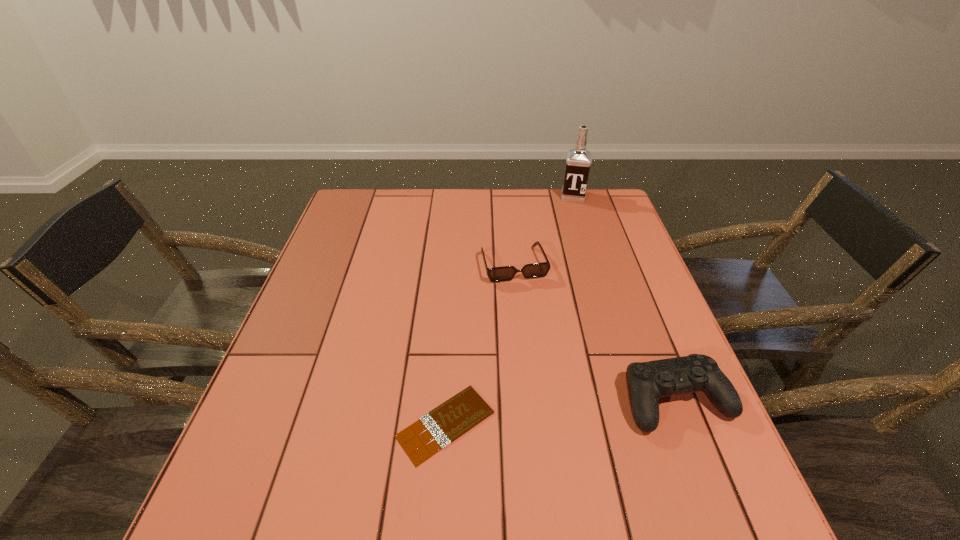
Find the location of a particular element. vacant space located on the front label of the farthest object is located at coordinates (570, 232).

Where is `vacant space located 0.400m on the front-facing side of the sunglasses`? This screenshot has height=540, width=960. vacant space located 0.400m on the front-facing side of the sunglasses is located at coordinates (567, 417).

Where is `vacant space situated 0.340m on the front-facing side of the sunglasses`? This screenshot has height=540, width=960. vacant space situated 0.340m on the front-facing side of the sunglasses is located at coordinates (558, 392).

Locate an element on the screen. This screenshot has height=540, width=960. vacant position located on the front-facing side of the sunglasses is located at coordinates (525, 298).

At what (x,y) coordinates should I click in order to perform the action: click on object situated at the far edge. Please return your answer as a coordinate pair (x, y). Looking at the image, I should click on [x=578, y=161].

At what (x,y) coordinates should I click in order to perform the action: click on chocolate bar that is at the near edge. Please return your answer as a coordinate pair (x, y). The width and height of the screenshot is (960, 540). Looking at the image, I should click on (447, 422).

The image size is (960, 540). Identify the location of control present at the near edge. (647, 382).

Find the location of `control located at the right edge`. control located at the right edge is located at coordinates (647, 382).

Locate an element on the screen. vodka located in the right edge section of the desktop is located at coordinates (578, 161).

Locate an element on the screen. The width and height of the screenshot is (960, 540). object at the far right corner is located at coordinates (578, 161).